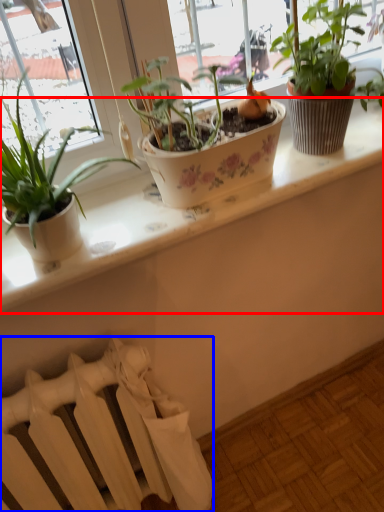
Question: Which object is further to the camera taking this photo, window sill (highlighted by a red box) or radiator (highlighted by a blue box)?

Choices:
 (A) window sill
 (B) radiator

Answer: (B)